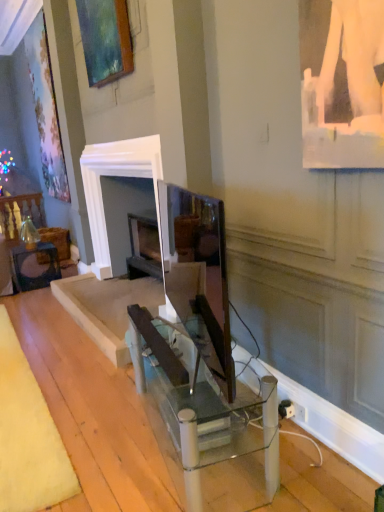
Question: Based on their sizes in the image, would you say matte glass table at lower left, which ranks as the second table in bottom-to-top order, is bigger or smaller than matte wooden picture frame at upper left?

Choices:
 (A) big
 (B) small

Answer: (B)

Question: From a real-world perspective, relative to matte wooden picture frame at upper left, is matte glass table at lower left, the first table viewed from the top, vertically above or below?

Choices:
 (A) below
 (B) above

Answer: (A)

Question: Considering the real-world distances, which object is farthest from the clear glass table at center, the second table when ordered from left to right?

Choices:
 (A) matte wooden picture frame at upper left
 (B) matte black monitor at center
 (C) matte glass table at lower left, which ranks as the second table in bottom-to-top order

Answer: (C)

Question: Which object is the closest to the matte glass table at lower left, acting as the 1th table starting from the left?

Choices:
 (A) clear glass table at center, which ranks as the first table in bottom-to-top order
 (B) matte black monitor at center
 (C) matte wooden picture frame at upper left

Answer: (C)